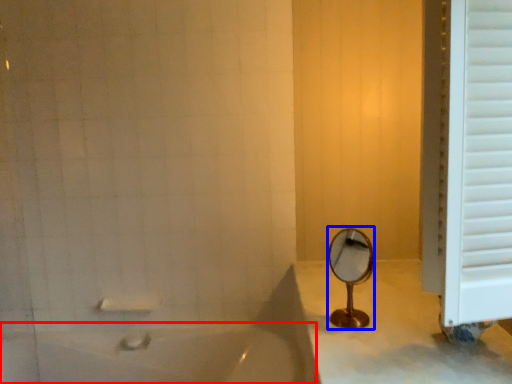
Question: Among these objects, which one is nearest to the camera, bathtub (highlighted by a red box) or mirror (highlighted by a blue box)?

Choices:
 (A) bathtub
 (B) mirror

Answer: (B)